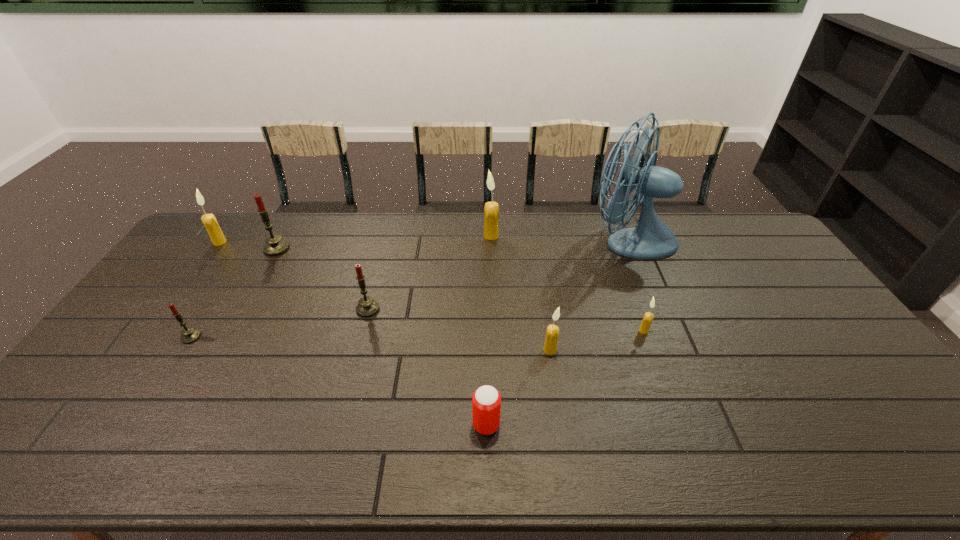
At what (x,y) coordinates should I click in order to perform the action: click on free space between the second biggest red candle and the nearest cream candle. Please return your answer as a coordinate pair (x, y). The image size is (960, 540). Looking at the image, I should click on (459, 330).

The width and height of the screenshot is (960, 540). In order to click on blank region between the second biggest cream candle and the beer can in this screenshot , I will do `click(353, 333)`.

This screenshot has width=960, height=540. Identify the location of vacant space that is in between the eighth object from right to left and the third biggest cream candle. (371, 343).

This screenshot has height=540, width=960. I want to click on vacant point located between the leftmost cream candle and the red beer can, so click(x=353, y=333).

Identify the location of vacant area that lies between the sixth object from right to left and the fan. (498, 275).

You are a GUI agent. You are given a task and a screenshot of the screen. Output one action in this format:
    pyautogui.click(x=<x>, y=<y>)
    Task: Click on the unoccupied area between the tallest object and the second nearest red candle
    This screenshot has width=960, height=540.
    Given the screenshot: What is the action you would take?
    pyautogui.click(x=498, y=275)

Identify which object is the eighth closest to the second tallest object. Please provide its 2D coordinates. Your answer should be formatted as a tuple, i.e. [(x, y)], where the tuple contains the x and y coordinates of a point satisfying the conditions above.

[(217, 237)]

This screenshot has height=540, width=960. What are the coordinates of `object that ranks as the fifth closest to the beer can` in the screenshot? It's located at (491, 211).

Point out which candle is positioned as the fifth nearest to the third biggest cream candle. Please provide its 2D coordinates. Your answer should be formatted as a tuple, i.e. [(x, y)], where the tuple contains the x and y coordinates of a point satisfying the conditions above.

[(189, 335)]

Find the location of `candle object that ranks as the second closest to the tallest candle`. candle object that ranks as the second closest to the tallest candle is located at coordinates (552, 332).